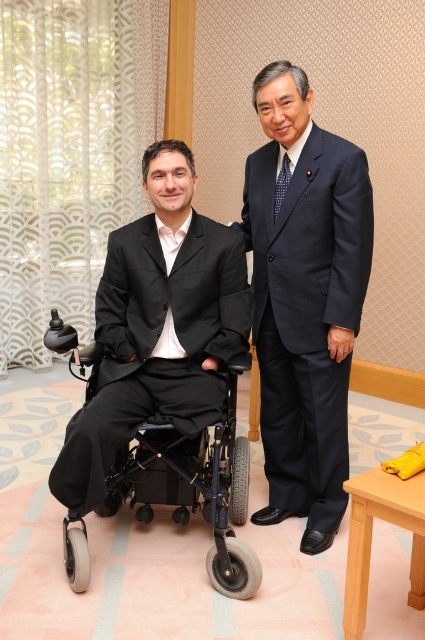
Question: Can you confirm if dark blue suit at center is positioned above black plastic wheelchair at left?

Choices:
 (A) yes
 (B) no

Answer: (A)

Question: Which of these objects is positioned farthest from the black plastic wheelchair at left?

Choices:
 (A) dark blue suit at center
 (B) matte black suit at center

Answer: (A)

Question: Does dark blue suit at center have a smaller size compared to black plastic wheelchair at left?

Choices:
 (A) no
 (B) yes

Answer: (A)

Question: Estimate the real-world distances between objects in this image. Which object is farther from the black plastic wheelchair at left?

Choices:
 (A) matte black suit at center
 (B) dark blue suit at center

Answer: (B)

Question: Which point is farther to the camera?

Choices:
 (A) (224, 468)
 (B) (320, 365)
 (C) (181, 429)

Answer: (A)

Question: Is dark blue suit at center positioned at the back of matte black suit at center?

Choices:
 (A) yes
 (B) no

Answer: (A)